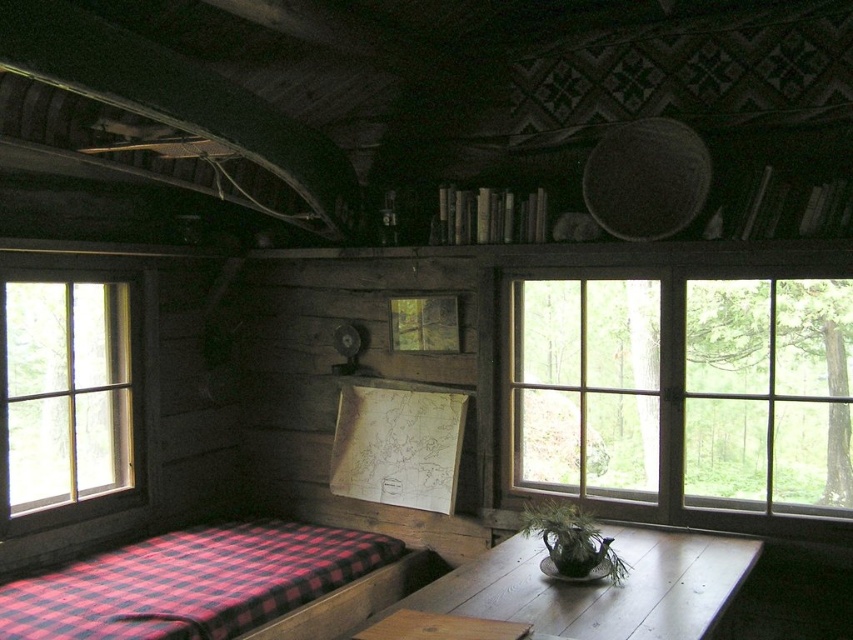
Does clear glass window at right appear over smooth wooden table at center?

Yes.

You are a GUI agent. You are given a task and a screenshot of the screen. Output one action in this format:
    pyautogui.click(x=<x>, y=<y>)
    Task: Click on the clear glass window at right
    
    Given the screenshot: What is the action you would take?
    pyautogui.click(x=685, y=390)

Is point (833, 490) closer to viewer compared to point (560, 611)?

No.

At what (x,y) coordinates should I click in order to perform the action: click on clear glass window at right. Please return your answer as a coordinate pair (x, y). Looking at the image, I should click on (685, 390).

Consider the image. Can you confirm if clear glass window at left is smaller than smooth wooden table at center?

Yes, clear glass window at left is smaller than smooth wooden table at center.

Is point (20, 476) closer to camera compared to point (698, 634)?

No, it is behind (698, 634).

Which is in front, point (57, 417) or point (407, 604)?

Positioned in front is point (407, 604).

The image size is (853, 640). Identify the location of clear glass window at left. click(x=68, y=394).

Does red checkered blanket at lower left appear on the left side of clear glass window at left?

In fact, red checkered blanket at lower left is to the right of clear glass window at left.

Which is in front, point (90, 570) or point (47, 340)?

Point (90, 570)

The image size is (853, 640). I want to click on red checkered blanket at lower left, so click(192, 582).